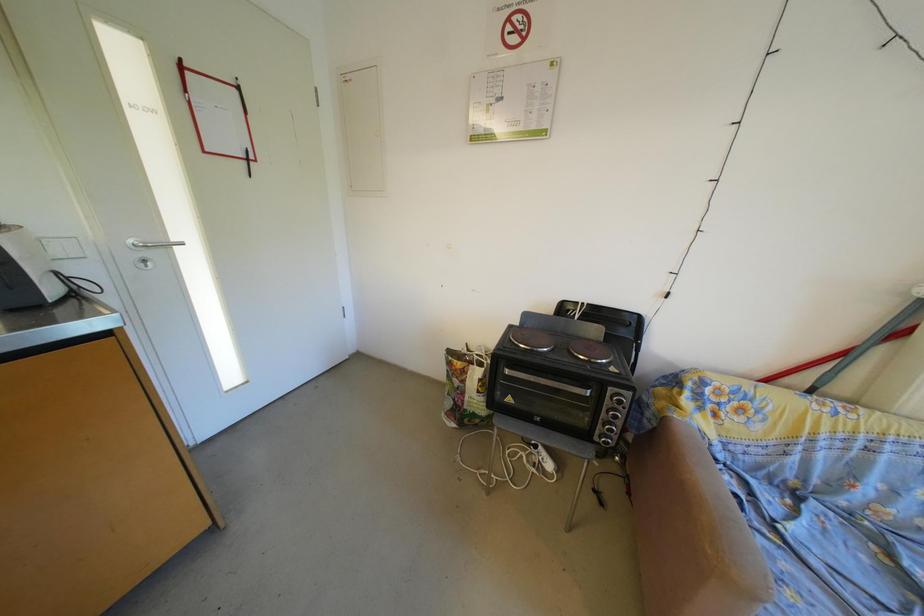
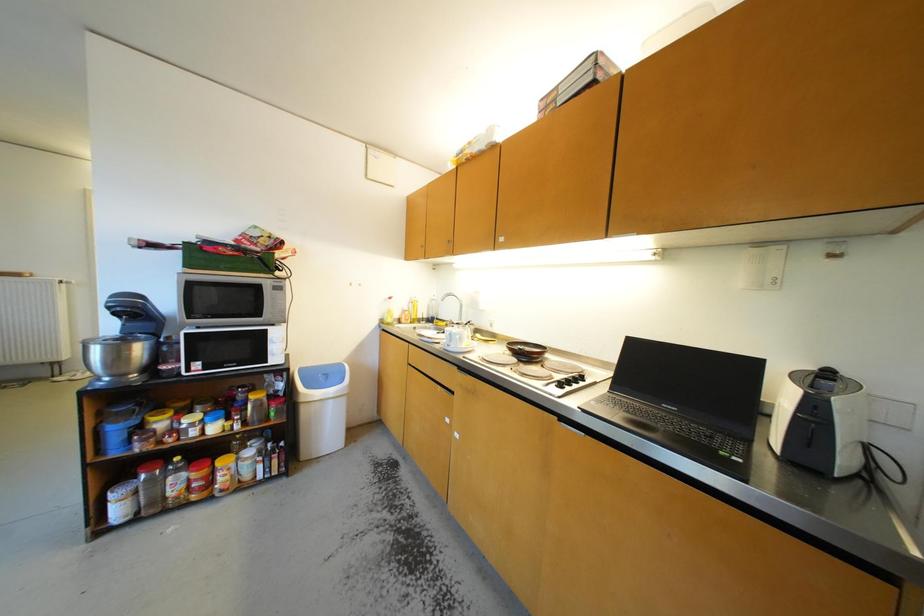
Question: The images are taken continuously from a first-person perspective. In which direction is your viewpoint rotating?

Choices:
 (A) Left
 (B) Right
 (C) Up
 (D) Down

Answer: (A)